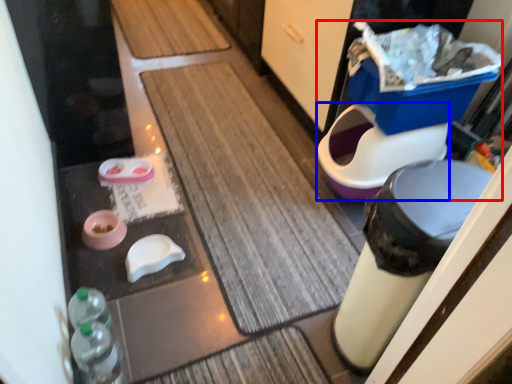
Question: Which object is further to the camera taking this photo, potty (highlighted by a red box) or toilet bowl (highlighted by a blue box)?

Choices:
 (A) potty
 (B) toilet bowl

Answer: (B)